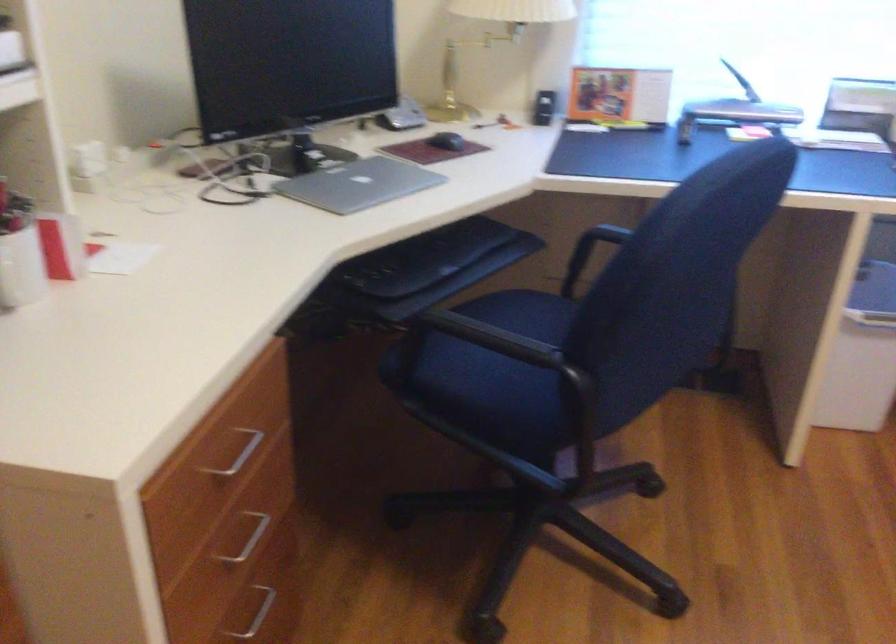
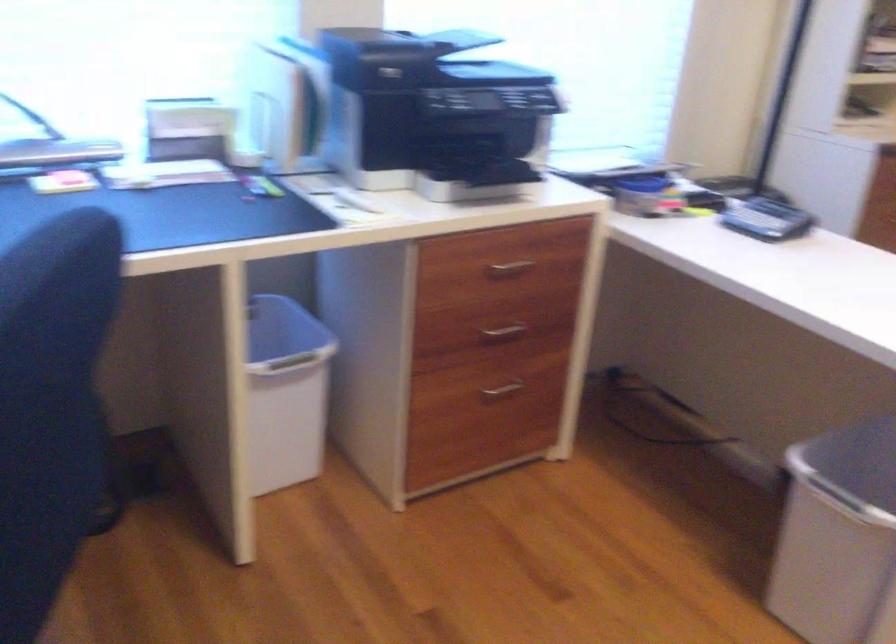
Question: The camera is either moving clockwise (left) or counter-clockwise (right) around the object. The first image is from the beginning of the video and the second image is from the end. Is the camera moving left or right when shooting the video?

Choices:
 (A) Left
 (B) Right

Answer: (A)